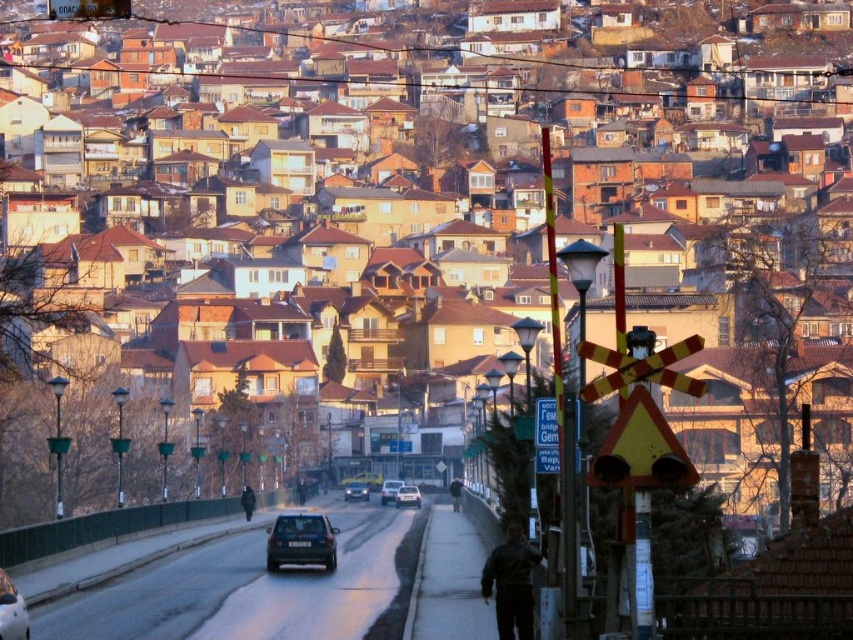
Can you confirm if satin black car at center is taller than shiny black sedan at center?

Indeed, satin black car at center has a greater height compared to shiny black sedan at center.

You are a GUI agent. You are given a task and a screenshot of the screen. Output one action in this format:
    pyautogui.click(x=<x>, y=<y>)
    Task: Click on the satin black car at center
    
    Given the screenshot: What is the action you would take?
    [x=300, y=541]

What do you see at coordinates (300, 541) in the screenshot?
I see `satin black car at center` at bounding box center [300, 541].

Where is `satin black car at center`? The image size is (853, 640). satin black car at center is located at coordinates (300, 541).

Looking at this image, does shiny silver car at lower left have a greater height compared to black matte person at center?

Indeed, shiny silver car at lower left has a greater height compared to black matte person at center.

Who is positioned more to the left, shiny silver car at lower left or black matte person at center?

shiny silver car at lower left is more to the left.

Where is `shiny silver car at lower left`? shiny silver car at lower left is located at coordinates (10, 611).

Can you confirm if matte black car at center is shorter than black matte person at center?

Yes.

Which is above, matte black car at center or black matte person at center?

black matte person at center is higher up.

Between point (393, 488) and point (250, 512), which one is positioned in front?

Point (250, 512) is in front.

Where is `matte black car at center`? matte black car at center is located at coordinates (389, 490).